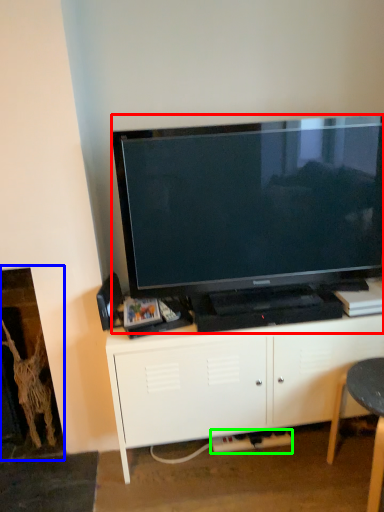
Question: Which is nearer to the television (highlighted by a red box)? fireplace (highlighted by a blue box) or plug (highlighted by a green box).

Choices:
 (A) fireplace
 (B) plug

Answer: (A)